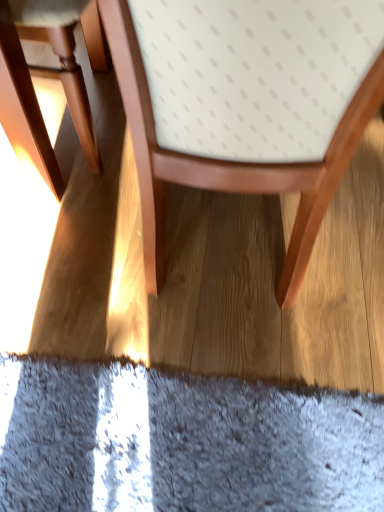
In order to click on vacant space to the left of wooden chair at center, the 1th chair when ordered from right to left in this screenshot , I will do `click(71, 306)`.